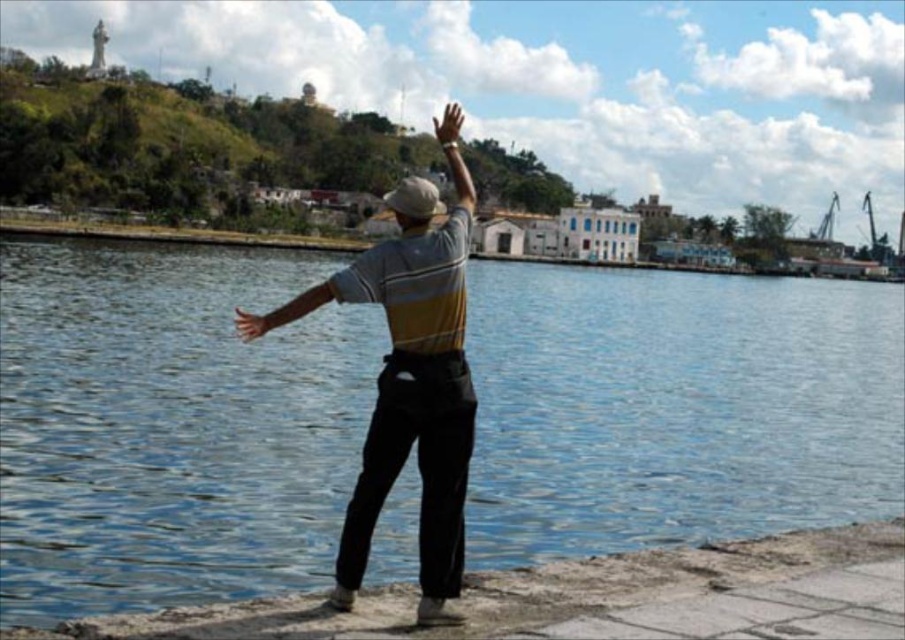
Question: Among these objects, which one is nearest to the camera?

Choices:
 (A) beige fabric baseball hat at center
 (B) blue water at center

Answer: (B)

Question: Which of the following is the closest to the observer?

Choices:
 (A) 441,248
 (B) 422,180

Answer: (A)

Question: From the image, what is the correct spatial relationship of matte gray shirt at center in relation to brown leather hand at upper center?

Choices:
 (A) above
 (B) below

Answer: (B)

Question: Where is matte gray shirt at center located in relation to smooth skin hand at center in the image?

Choices:
 (A) right
 (B) left

Answer: (A)

Question: Considering the real-world distances, which object is farthest from the matte yellow shirt at center?

Choices:
 (A) matte gray shirt at center
 (B) beige fabric baseball hat at center

Answer: (B)

Question: Can you confirm if beige fabric baseball hat at center is wider than brown leather hand at upper center?

Choices:
 (A) yes
 (B) no

Answer: (A)